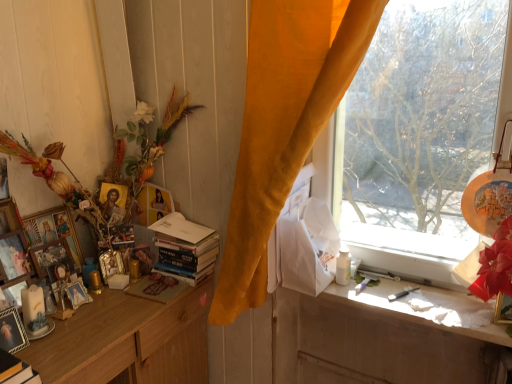
Identify the location of free spot above white paper bag at right (from a real-world perspective). The height and width of the screenshot is (384, 512). (418, 295).